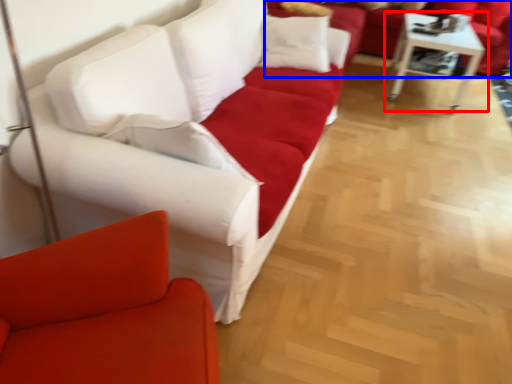
Question: Which point is closer to the camera, table (highlighted by a red box) or studio couch (highlighted by a blue box)?

Choices:
 (A) table
 (B) studio couch

Answer: (A)